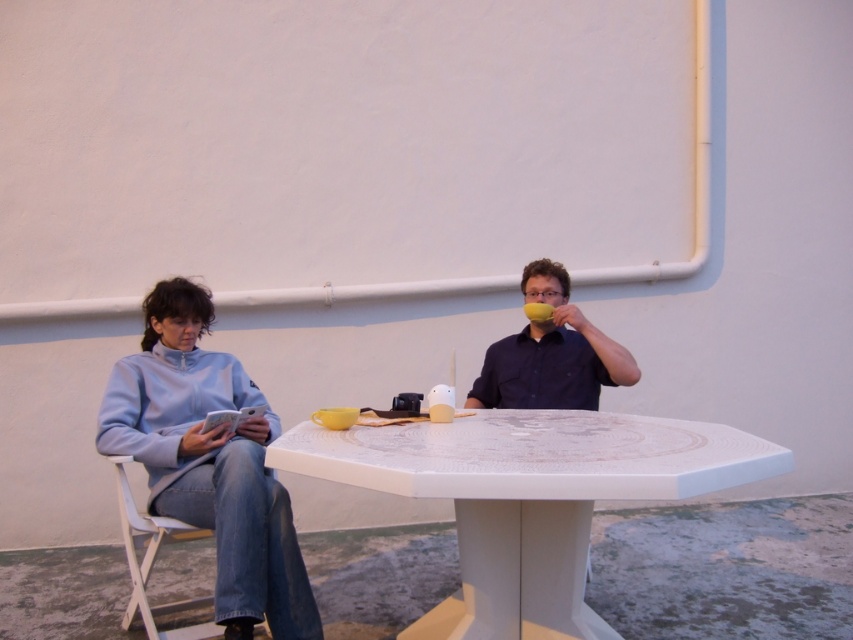
Question: Is white glossy table at center below white plastic chair at lower left?

Choices:
 (A) no
 (B) yes

Answer: (A)

Question: Estimate the real-world distances between objects in this image. Which object is closer to the white glossy table at center?

Choices:
 (A) matte yellow cup at upper center
 (B) light blue fleece jacket at left
 (C) white plastic chair at lower left

Answer: (A)

Question: Among these points, which one is nearest to the camera?

Choices:
 (A) (173, 628)
 (B) (445, 605)

Answer: (B)

Question: Does white glossy table at center appear over light blue fleece jacket at left?

Choices:
 (A) yes
 (B) no

Answer: (B)

Question: Does light blue fleece jacket at left have a smaller size compared to matte yellow cup at upper center?

Choices:
 (A) no
 (B) yes

Answer: (A)

Question: Among these objects, which one is farthest from the camera?

Choices:
 (A) white glossy table at center
 (B) light blue fleece jacket at left
 (C) matte yellow cup at upper center
 (D) white plastic chair at lower left

Answer: (C)